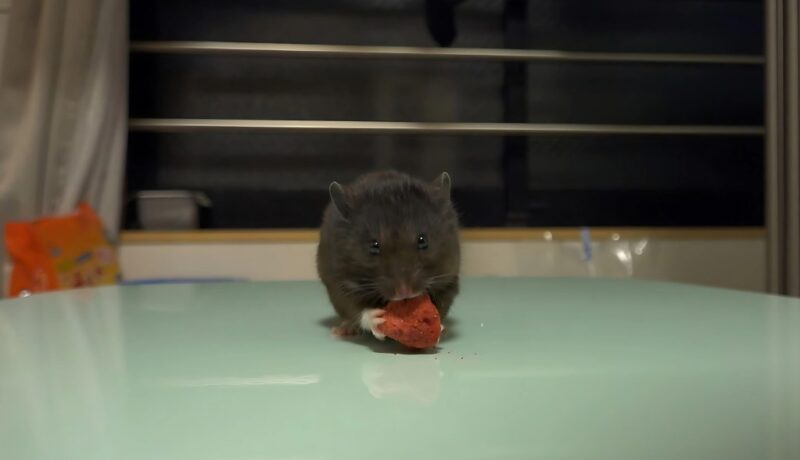
Identify the location of box. This screenshot has height=460, width=800. (166, 222).